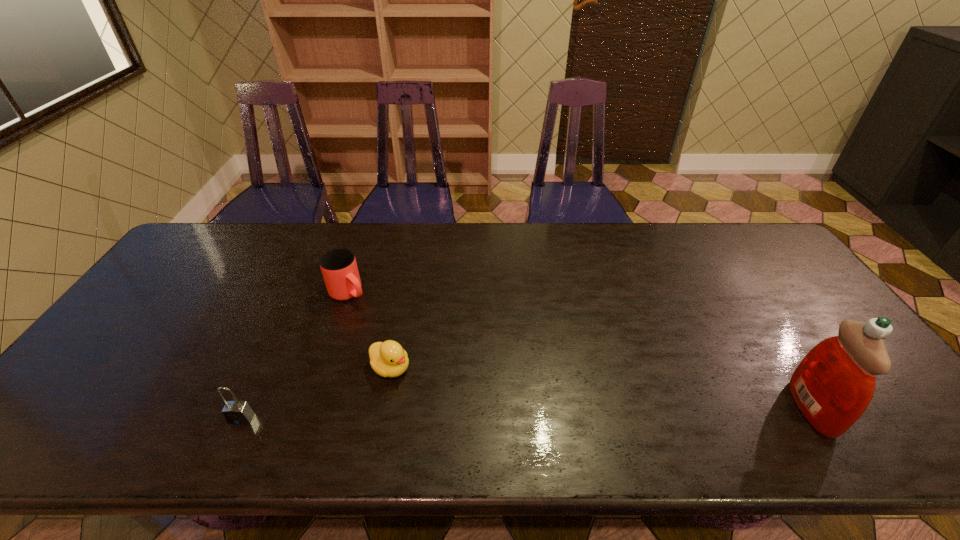
You are a GUI agent. You are given a task and a screenshot of the screen. Output one action in this format:
    pyautogui.click(x=<x>, y=<y>)
    Task: Click on the vacant space in between the padlock and the tallest object
    
    Given the screenshot: What is the action you would take?
    pyautogui.click(x=526, y=413)

This screenshot has width=960, height=540. Find the location of `vacant area between the cup and the shortest object`. vacant area between the cup and the shortest object is located at coordinates (370, 330).

Where is `object that stands as the third closest to the rightmost object`? Image resolution: width=960 pixels, height=540 pixels. object that stands as the third closest to the rightmost object is located at coordinates (236, 412).

Find the location of a particular element. the second closest object to the cup is located at coordinates (236, 412).